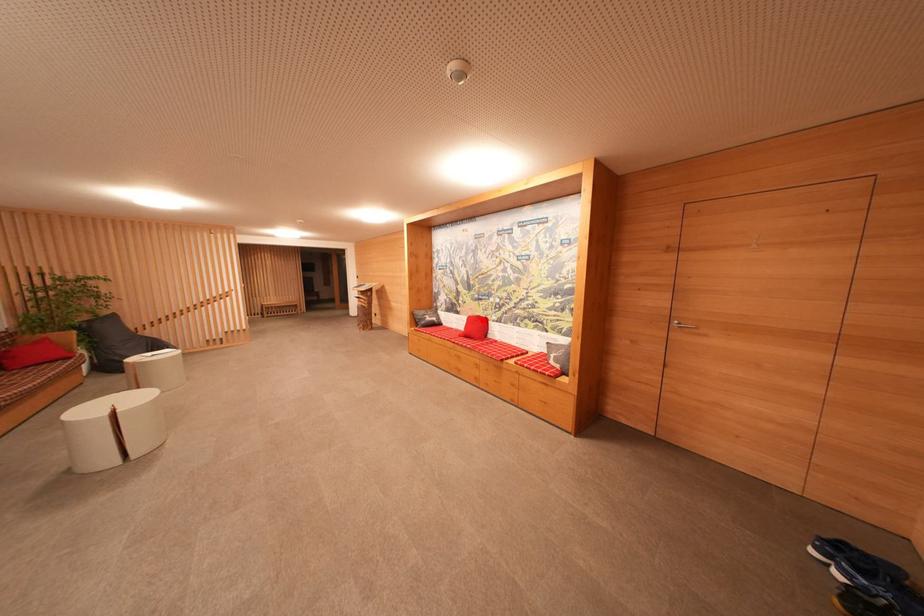
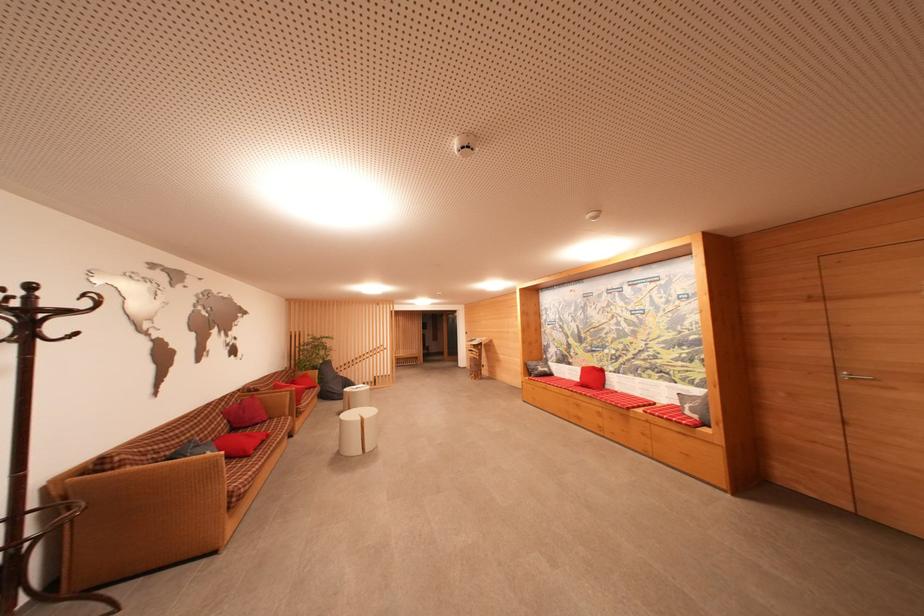
The point at the highlighted location is marked in the first image. Where is the corresponding point in the second image?

(598, 371)